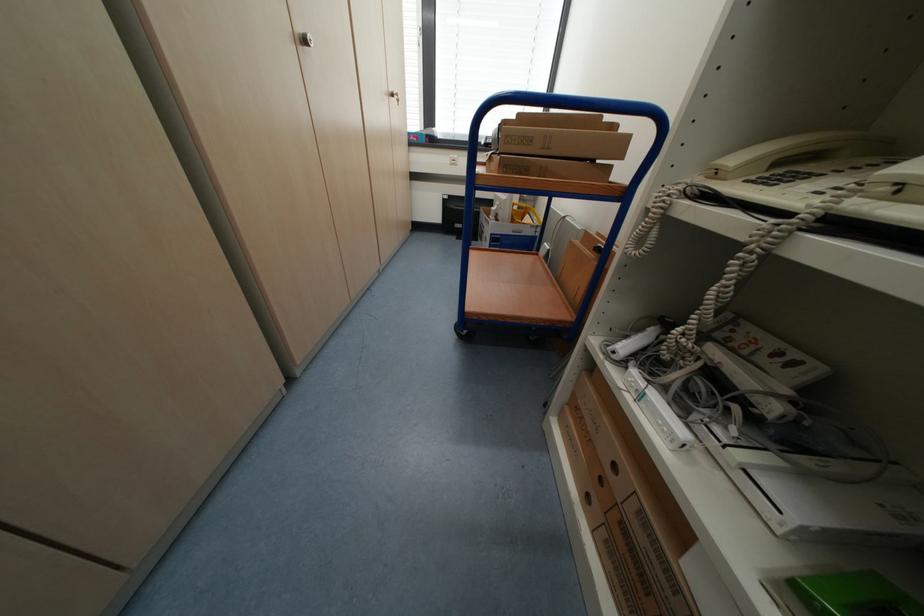
What do you see at coordinates (569, 103) in the screenshot? I see `the blue cart handle` at bounding box center [569, 103].